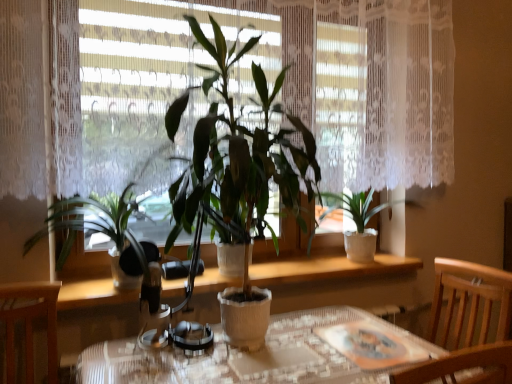
Where is `vacant space to the right of metallic silver headphones at center`? This screenshot has width=512, height=384. vacant space to the right of metallic silver headphones at center is located at coordinates (234, 343).